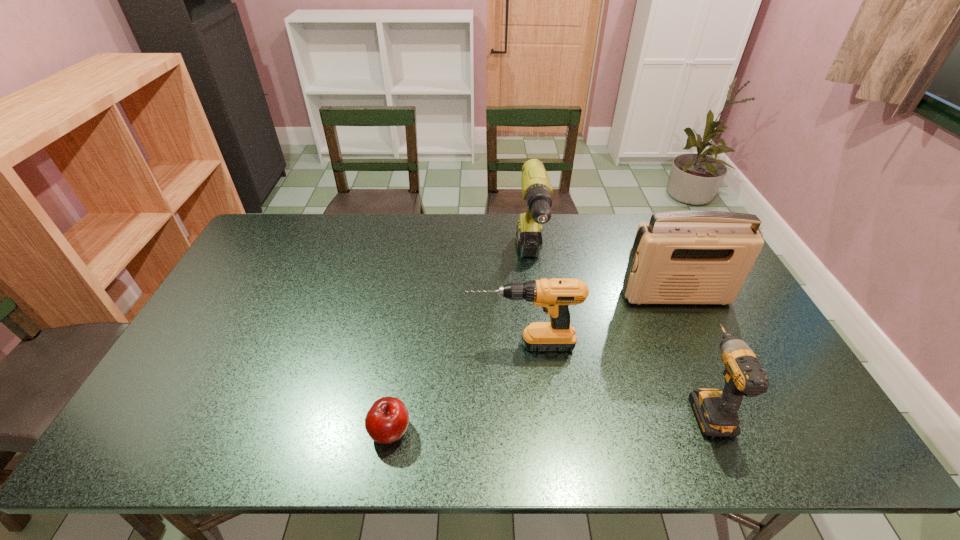
Find the location of a particular element. The image size is (960, 540). the farthest drill is located at coordinates (536, 188).

Locate an element on the screen. This screenshot has width=960, height=540. radio receiver is located at coordinates (679, 257).

Find the location of `the second nearest drill`. the second nearest drill is located at coordinates (554, 295).

What are the coordinates of `the rightmost drill` in the screenshot? It's located at (716, 411).

Find the location of a particular element. The width and height of the screenshot is (960, 540). apple is located at coordinates (387, 420).

The width and height of the screenshot is (960, 540). In order to click on the shortest object in this screenshot , I will do `click(387, 420)`.

At what (x,y) coordinates should I click in order to perform the action: click on vacant area located 0.250m on the handle side of the farthest drill. Please return your answer as a coordinate pair (x, y). Looking at the image, I should click on (543, 362).

In order to click on free space located on the front-facing side of the radio receiver in this screenshot , I will do `click(729, 409)`.

Where is `free space located at the tip of the third nearest object`? This screenshot has width=960, height=540. free space located at the tip of the third nearest object is located at coordinates (434, 345).

You are a GUI agent. You are given a task and a screenshot of the screen. Output one action in this format:
    pyautogui.click(x=<x>, y=<y>)
    Task: Click on the vacant region located at the tip of the third nearest object
    The width and height of the screenshot is (960, 540).
    Given the screenshot: What is the action you would take?
    pyautogui.click(x=423, y=345)